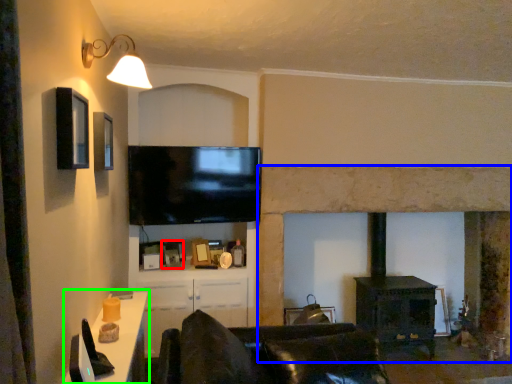
Question: Which object is the closest to the picture frame (highlighted by a red box)? Choose among these: fireplace (highlighted by a blue box) or table (highlighted by a green box).

Choices:
 (A) fireplace
 (B) table

Answer: (A)